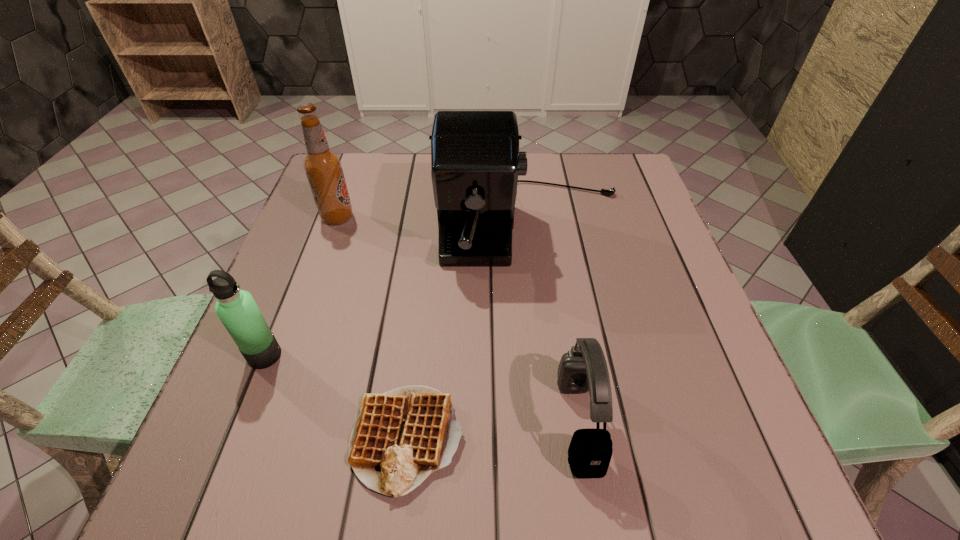
Locate an element on the screen. The image size is (960, 540). free space located on the headband of the headset is located at coordinates (526, 422).

Identify the location of vacant space situated on the headband of the headset. (485, 422).

Image resolution: width=960 pixels, height=540 pixels. I want to click on free space located on the back of the waffle, so click(425, 280).

What are the coordinates of `object present at the far edge` in the screenshot? It's located at (475, 161).

Where is `headset at the near edge`? The image size is (960, 540). headset at the near edge is located at coordinates (583, 368).

Identify the location of waffle situated at the near edge. The image size is (960, 540). (400, 437).

You are a GUI agent. You are given a task and a screenshot of the screen. Output one action in this format:
    pyautogui.click(x=<x>, y=<y>)
    Task: Click on the beer bottle at the left edge
    
    Given the screenshot: What is the action you would take?
    pyautogui.click(x=323, y=167)

Find the location of `thermos bottle at the left edge`. thermos bottle at the left edge is located at coordinates (237, 310).

Identify the location of object present at the right edge. (475, 161).

This screenshot has width=960, height=540. Find the location of `object that is at the far right corner`. object that is at the far right corner is located at coordinates (475, 161).